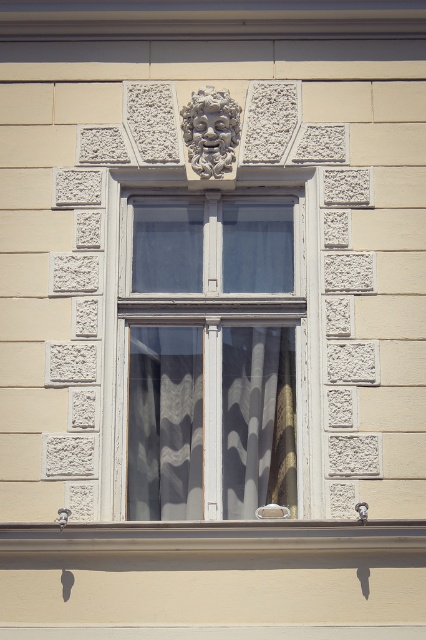
Consider the image. Does white wood window at center have a smaller size compared to white lace curtain at center?

Actually, white wood window at center might be larger than white lace curtain at center.

This screenshot has width=426, height=640. What do you see at coordinates (209, 355) in the screenshot?
I see `white wood window at center` at bounding box center [209, 355].

Find the location of a particular element. The height and width of the screenshot is (640, 426). white wood window at center is located at coordinates (209, 355).